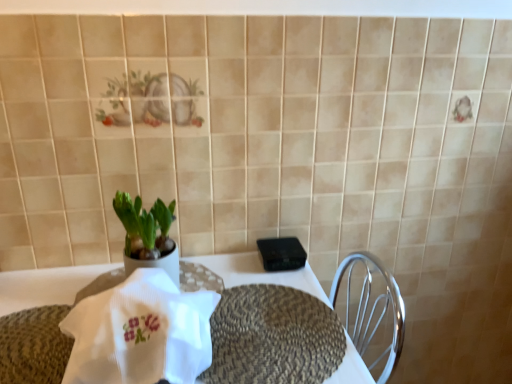
In order to click on empty space that is in between black plastic device at center and green matte plant at center in this screenshot , I will do `click(227, 272)`.